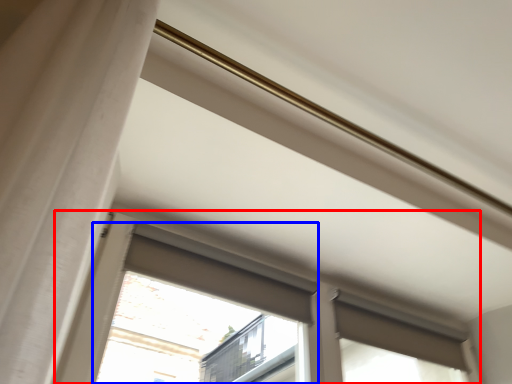
Question: Among these objects, which one is farthest to the camera, window (highlighted by a red box) or bay window (highlighted by a blue box)?

Choices:
 (A) window
 (B) bay window

Answer: (B)